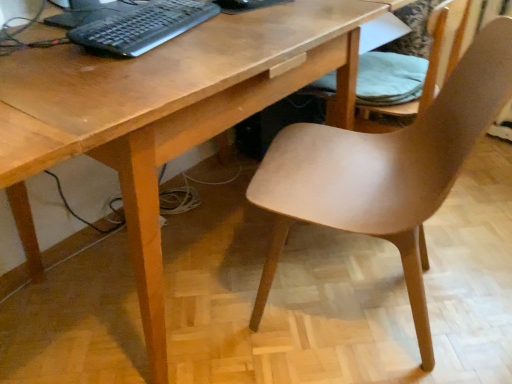
This screenshot has height=384, width=512. What are the coordinates of `vacant space to the right of matte wood chair at center, arranged as the second chair when viewed from the back` in the screenshot? It's located at (466, 278).